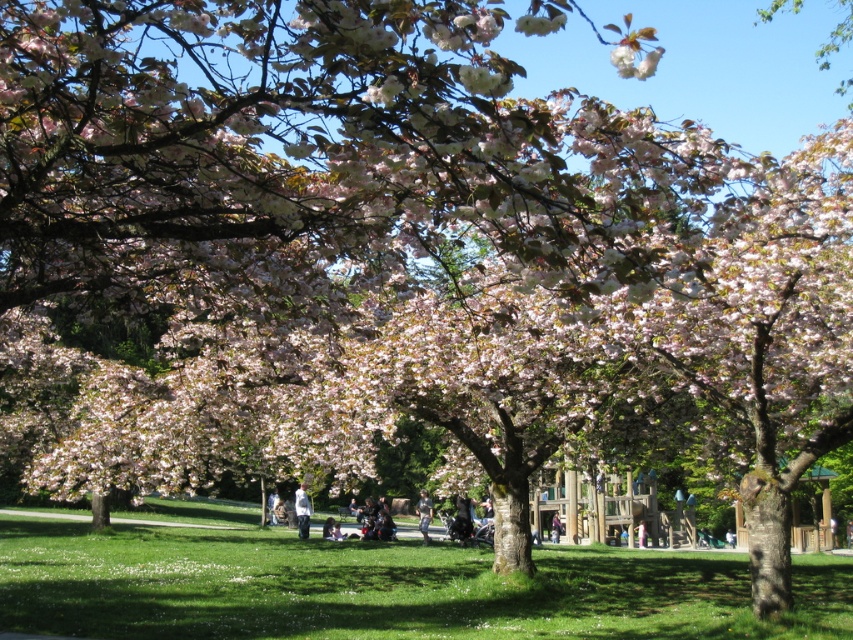
You are a photographer setting up a tripod in the park. You see a denim jacket at center and dark blue jeans at center. Which object should you place your tripod to the right of to avoid blocking both items?

You should place your tripod to the right of the dark blue jeans at center because the denim jacket at center is already to the left of it, so positioning the tripod to the right of the jeans ensures it doesn

You are standing in the park and want to walk from the point closer to you to the farther point. Which path would you take between the two points labeled as point (x=427, y=502) and point (x=558, y=531)?

You should walk from point (x=427, y=502) to point (x=558, y=531) because point (x=427, y=502) is closer to the viewer, so moving towards point (x=558, y=531) would be moving away from your current position.